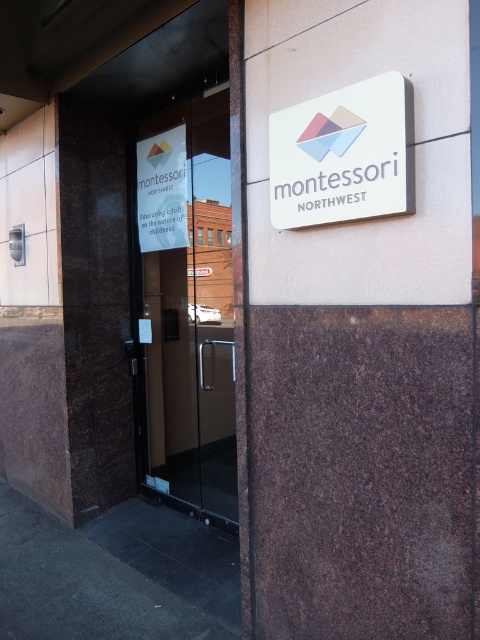
Question: Does white plastic sign at upper center appear under white paper sign at left?

Choices:
 (A) no
 (B) yes

Answer: (B)

Question: Among these objects, which one is farthest from the camera?

Choices:
 (A) white plastic sign at upper center
 (B) transparent glass door at center

Answer: (B)

Question: Which point is closer to the camera taking this photo?

Choices:
 (A) (228, 304)
 (B) (159, 173)

Answer: (B)

Question: Considering the relative positions of transparent glass door at center and white paper sign at left in the image provided, where is transparent glass door at center located with respect to white paper sign at left?

Choices:
 (A) right
 (B) left

Answer: (A)

Question: Can you confirm if transparent glass door at center is positioned to the left of white paper sign at left?

Choices:
 (A) no
 (B) yes

Answer: (A)

Question: Which of the following is the farthest from the observer?

Choices:
 (A) transparent glass door at center
 (B) white plastic sign at upper center
 (C) white paper sign at left

Answer: (C)